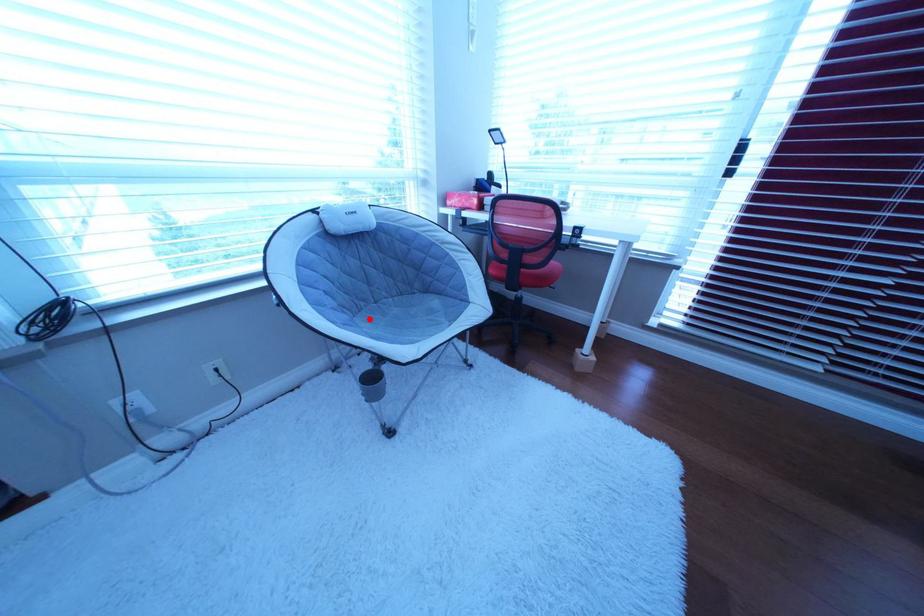
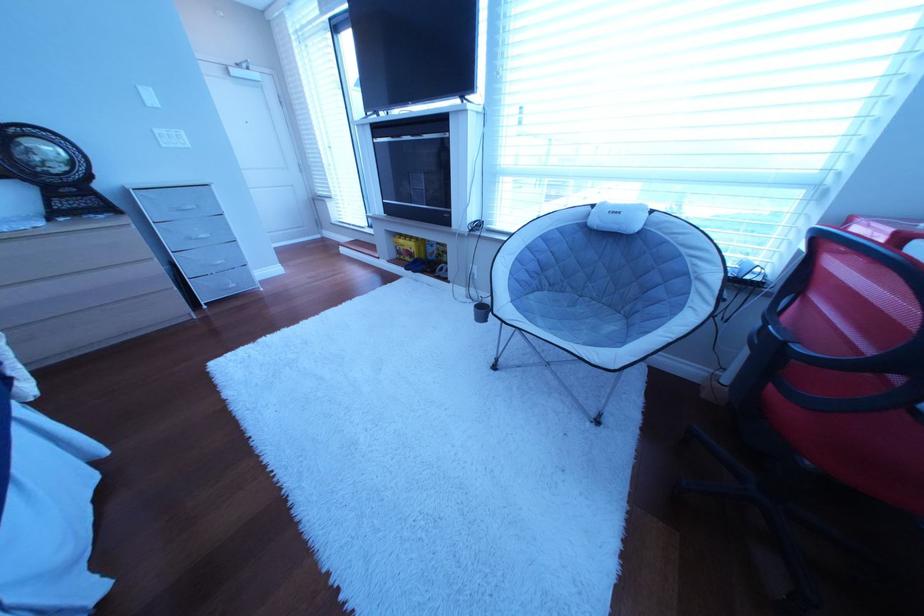
Where in the second image is the point corresponding to the highlighted location from the first image?

(565, 293)